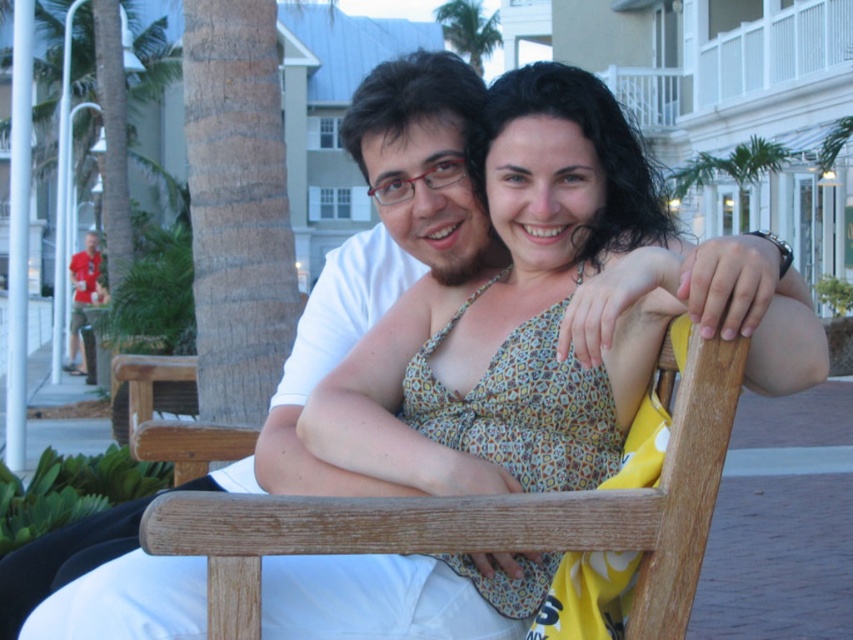
You are standing at the origin point in the image and need to move towards the wooden chair at center. Which direction should you go?

The wooden chair at center is located at point (490, 518), so you should move towards the right and forward to reach it.

In the scene shown: Based on the scene description, which palm tree is shorter? The green leafy palm tree at upper right or the green leafy palm tree at upper center?

The green leafy palm tree at upper right is shorter than the green leafy palm tree at upper center.